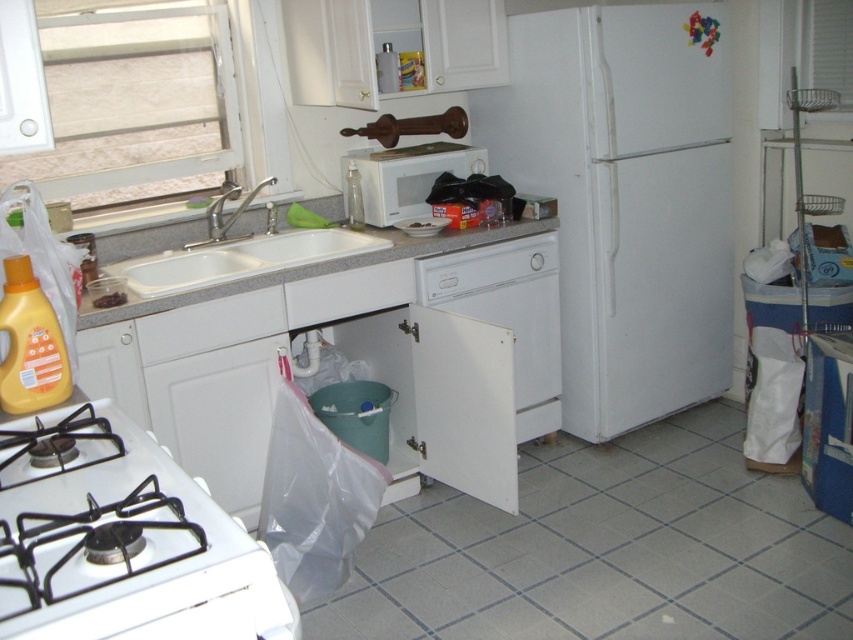
You are organizing the kitchen and need to place a new shelf. The shelf must be placed between the white matte refrigerator at center right and the white glossy sink at upper left. Based on their positions, where should the shelf be positioned relative to the sink?

The white matte refrigerator at center right is located above the white glossy sink at upper left, so the shelf should be placed below the refrigerator and above the sink to fit between them.

What object is located at the coordinates point (625,198) in the kitchen scene?

The point (625,198) corresponds to the white matte refrigerator at center right.

Please provide the coordinates of the white matte refrigerator at center right in the kitchen scene described.

The white matte refrigerator at center right is located at coordinates point (x=625, y=198).